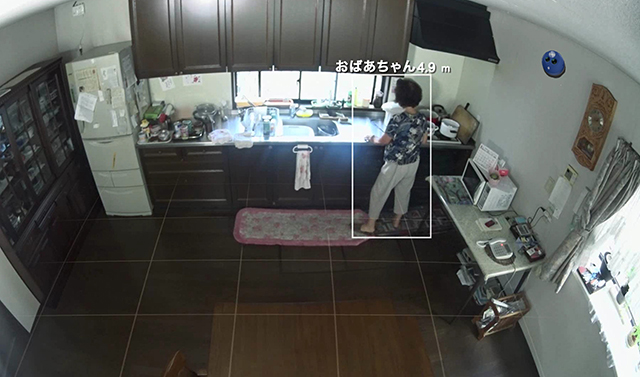
Where is `clock`? The width and height of the screenshot is (640, 377). clock is located at coordinates (594, 131).